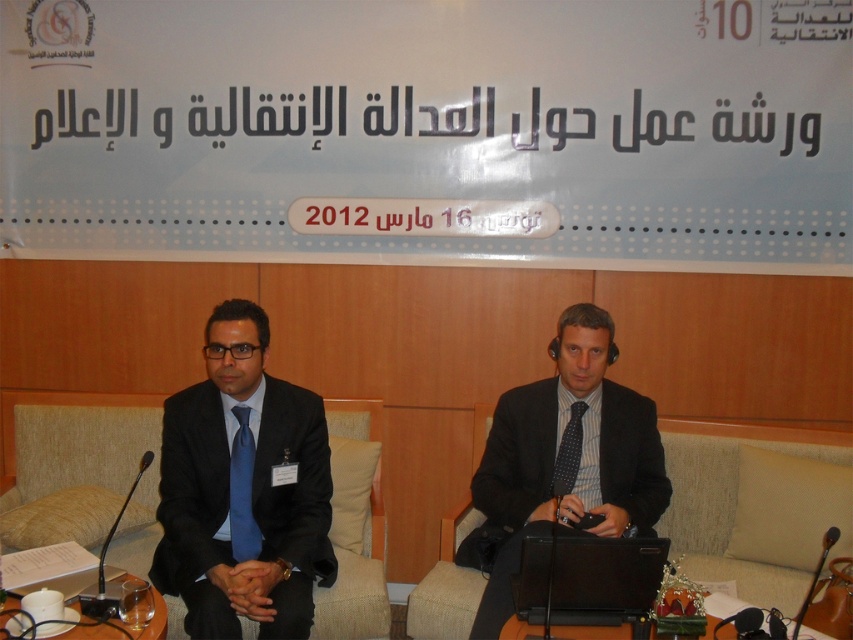
Is dark suit at center taller than beige fabric couch at center?

Yes, dark suit at center is taller than beige fabric couch at center.

Does point (616, 524) come behind point (722, 464)?

No, (616, 524) is closer to viewer.

Which is in front, point (474, 545) or point (473, 582)?

Point (473, 582) is more forward.

What are the coordinates of `dark suit at center` in the screenshot? It's located at (563, 461).

Who is lower down, dark suit at center or blue silk tie at center?

dark suit at center is below.

Is dark suit at center above blue silk tie at center?

No, dark suit at center is not above blue silk tie at center.

Is point (648, 397) behind point (242, 513)?

That is True.

Locate an element on the screen. dark suit at center is located at coordinates (563, 461).

Who is positioned more to the right, black matte suit at left or translucent glass table at lower left?

black matte suit at left

Is black matte suit at left positioned behind translucent glass table at lower left?

Yes, it is.

Find the location of a particular element. This screenshot has width=853, height=640. black matte suit at left is located at coordinates (242, 490).